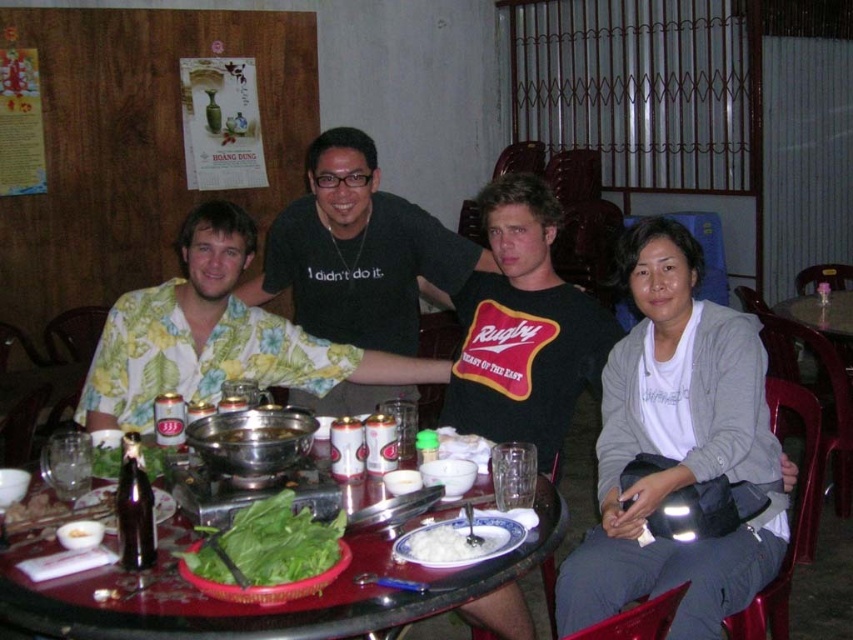
You are a photographer trying to capture a group photo of the white cotton shirt at center and the yellow floral shirt at left. Since you want to ensure both subjects are in focus, you need to know which one is closer to the camera. Can you determine which is nearer?

The white cotton shirt at center is thinner than the yellow floral shirt at left, but this does not indicate their distance from the camera. You need to adjust your focus manually or use depth of field techniques to ensure both are in focus.

You are standing at the edge of the table and want to reach the point marked at coordinates point (477, 257). Can you comfortably stretch your hand to that spot without moving your feet?

The distance between you and the point (477, 257) is 8.55 feet. Since the average human arm span is about 3 feet, you cannot comfortably reach that point without moving your feet.

You are sitting at the dining table and want to hand a napkin to the person in the white cotton shirt at center and the yellow floral shirt at left. Which one can you reach without moving from your current position?

The white cotton shirt at center is closer to the viewer, so you can reach them first without moving.